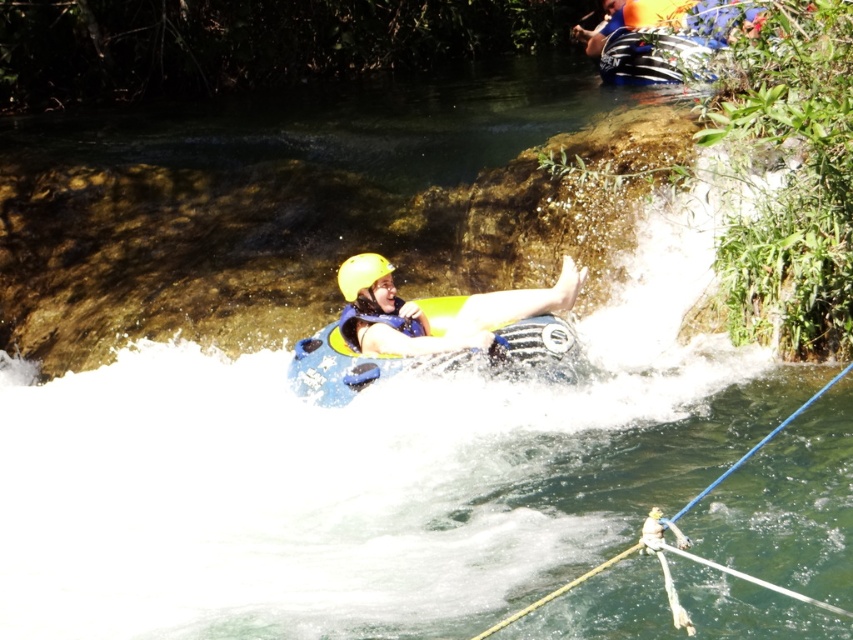
Who is shorter, blue rubber paddle at lower center or yellow matte helmet at center?

blue rubber paddle at lower center is shorter.

Does blue rubber paddle at lower center appear on the right side of yellow matte helmet at center?

Yes, blue rubber paddle at lower center is to the right of yellow matte helmet at center.

Describe the element at coordinates (759, 444) in the screenshot. I see `blue rubber paddle at lower center` at that location.

The height and width of the screenshot is (640, 853). I want to click on blue rubber paddle at lower center, so click(x=759, y=444).

In the scene shown: Who is higher up, yellow matte life vest at center or yellow matte helmet at center?

Positioned higher is yellow matte helmet at center.

This screenshot has width=853, height=640. What are the coordinates of `yellow matte life vest at center` in the screenshot? It's located at (444, 314).

In the scene shown: Between blue rubber boat at center and blue rubber paddle at lower center, which one appears on the right side from the viewer's perspective?

blue rubber paddle at lower center

Between blue rubber boat at center and blue rubber paddle at lower center, which one is positioned higher?

blue rubber boat at center is higher up.

Image resolution: width=853 pixels, height=640 pixels. What do you see at coordinates (349, 365) in the screenshot?
I see `blue rubber boat at center` at bounding box center [349, 365].

At what (x,y) coordinates should I click in order to perform the action: click on blue rubber boat at center. Please return your answer as a coordinate pair (x, y). The width and height of the screenshot is (853, 640). Looking at the image, I should click on (349, 365).